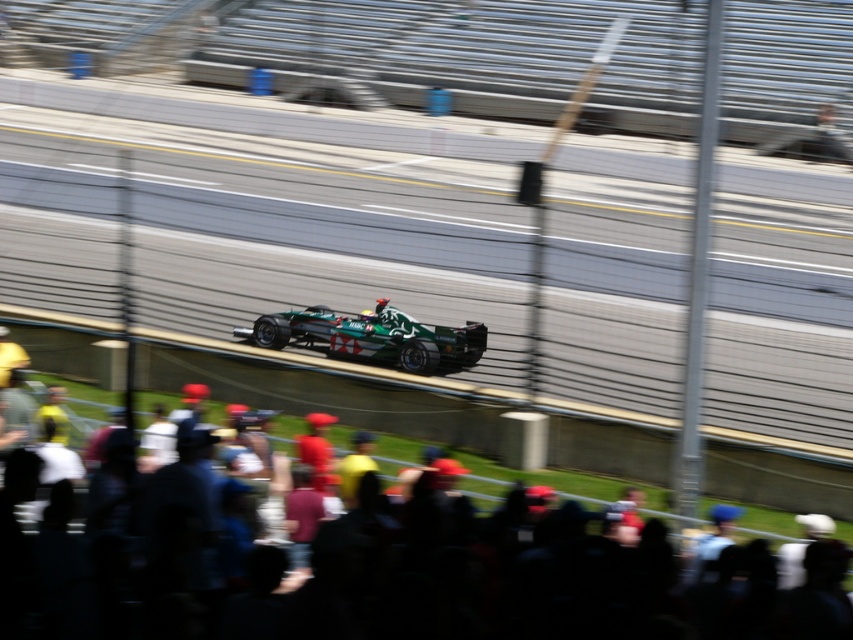
Can you confirm if dark blue fabric crowd at lower center is smaller than green matte race car at center?

Actually, dark blue fabric crowd at lower center might be larger than green matte race car at center.

Who is lower down, dark blue fabric crowd at lower center or green matte race car at center?

Positioned lower is dark blue fabric crowd at lower center.

Does point (401, 609) come behind point (401, 365)?

No, (401, 609) is in front of (401, 365).

Where is `dark blue fabric crowd at lower center`? The image size is (853, 640). dark blue fabric crowd at lower center is located at coordinates (549, 582).